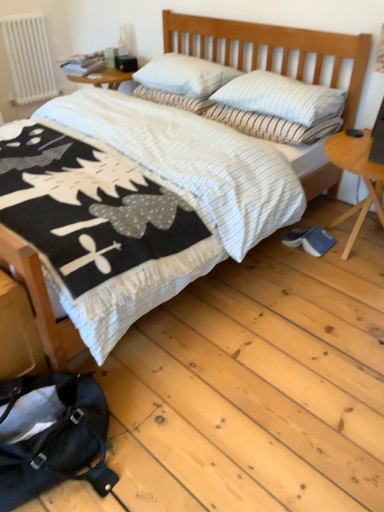
Question: From a real-world perspective, relative to white striped pillow at center, marked as the 1th pillow in a top-to-bottom arrangement, is white striped pillow at upper center, which is the 1th pillow from bottom to top, vertically above or below?

Choices:
 (A) below
 (B) above

Answer: (A)

Question: Choose the correct answer: Is white striped pillow at upper center, which is the 1th pillow from bottom to top, inside white striped pillow at center, marked as the 1th pillow in a top-to-bottom arrangement, or outside it?

Choices:
 (A) outside
 (B) inside

Answer: (A)

Question: Which is nearer to the white quilted bed at center?

Choices:
 (A) white painted metal radiator at upper left
 (B) black leather messenger bag at lower left
 (C) white striped pillow at upper center, arranged as the third pillow when viewed from the top
 (D) white striped pillow at center, acting as the second pillow starting from the top
 (E) white striped pillow at upper center, which is the 1th pillow from bottom to top

Answer: (C)

Question: Considering the real-world distances, which object is closest to the white quilted bed at center?

Choices:
 (A) white striped pillow at center, acting as the second pillow starting from the top
 (B) white striped pillow at upper center, which ranks as the second pillow in bottom-to-top order
 (C) white striped pillow at center, placed as the fourth pillow when sorted from bottom to top
 (D) white striped pillow at upper center, the fourth pillow from the top
 (E) black leather messenger bag at lower left

Answer: (B)